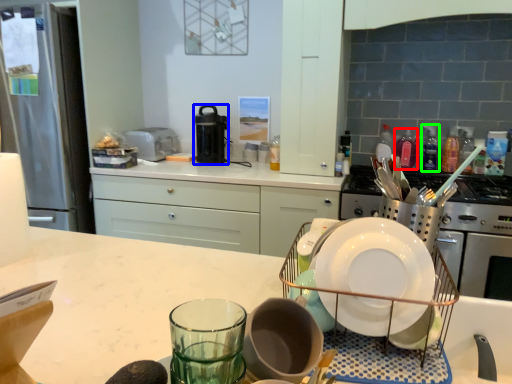
Question: Which object is the farthest from bottle (highlighted by a red box)? Choose among these: kitchen appliance (highlighted by a blue box) or bottle (highlighted by a green box).

Choices:
 (A) kitchen appliance
 (B) bottle

Answer: (A)